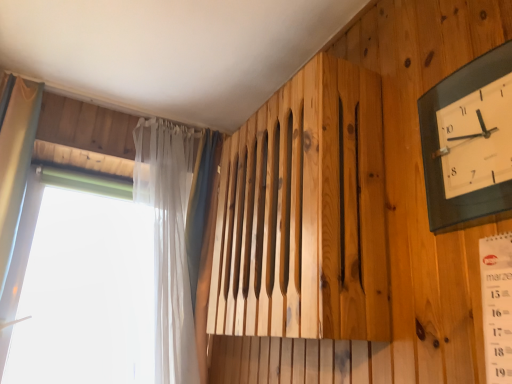
Question: From a real-world perspective, is translucent fabric curtain at left above or below transparent plastic window at left?

Choices:
 (A) above
 (B) below

Answer: (A)

Question: Is translucent fabric curtain at left wider or thinner than transparent plastic window at left?

Choices:
 (A) thin
 (B) wide

Answer: (B)

Question: Considering the real-world distances, which object is farthest from the transparent plastic window at left?

Choices:
 (A) translucent fabric curtain at left
 (B) black glass wall clock at upper right

Answer: (B)

Question: Which is nearer to the black glass wall clock at upper right?

Choices:
 (A) translucent fabric curtain at left
 (B) transparent plastic window at left

Answer: (B)